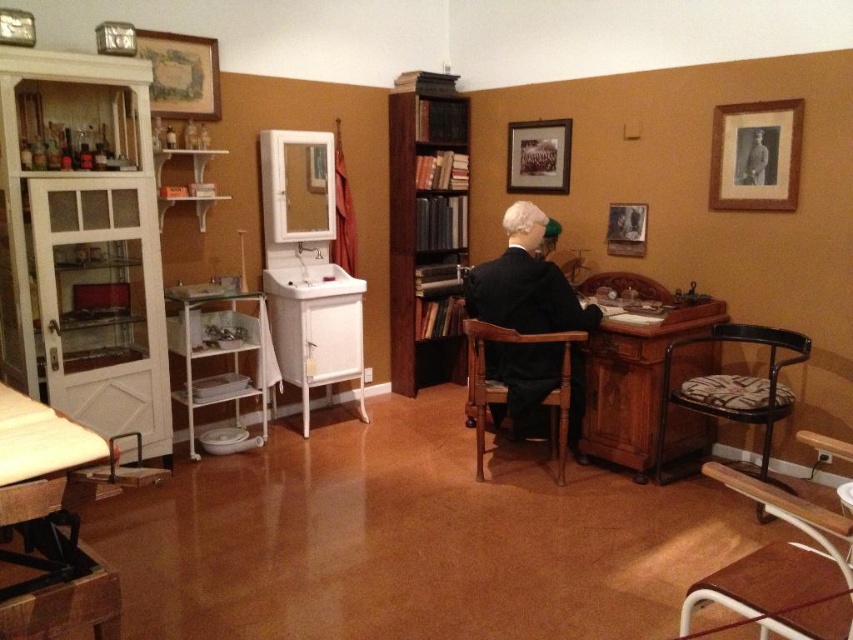
Question: Estimate the real-world distances between objects in this image. Which object is closer to the wooden table at lower left?

Choices:
 (A) brown wooden bookshelf at center
 (B) black leather chair at right

Answer: (B)

Question: Among these objects, which one is nearest to the camera?

Choices:
 (A) black matte suit at center
 (B) black leather chair at right
 (C) mahogany wood desk at center

Answer: (B)

Question: Which object is the farthest from the mahogany wood desk at center?

Choices:
 (A) black suit at center
 (B) black matte suit at center
 (C) uniformed man at center
 (D) wooden table at lower left

Answer: (D)

Question: Does brown fabric chair at lower right appear on the left side of wooden framed photograph at upper right?

Choices:
 (A) yes
 (B) no

Answer: (A)

Question: From the image, what is the correct spatial relationship of mahogany wood desk at center in relation to uniformed man at center?

Choices:
 (A) left
 (B) right

Answer: (A)

Question: Can you confirm if black matte suit at center is bigger than black suit at center?

Choices:
 (A) yes
 (B) no

Answer: (A)